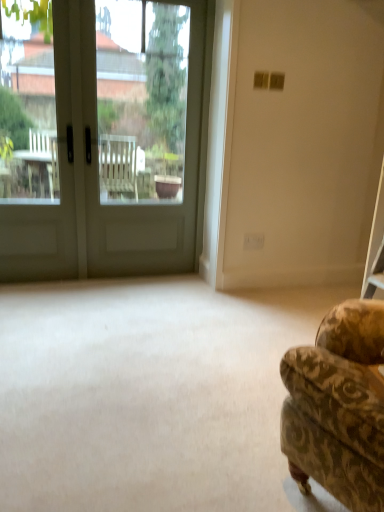
Measure the distance between point (x=36, y=224) and camera.

The depth of point (x=36, y=224) is 9.44 feet.

What is the approximate height of white glossy door at upper left?

The height of white glossy door at upper left is 1.87 meters.

Find the location of a particular element. white glossy door at upper left is located at coordinates (97, 178).

What do you see at coordinates (97, 178) in the screenshot? This screenshot has width=384, height=512. I see `white glossy door at upper left` at bounding box center [97, 178].

Where is `white glossy door at upper left`? white glossy door at upper left is located at coordinates (97, 178).